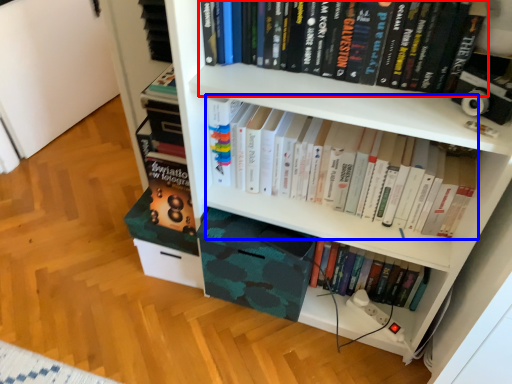
Question: Among these objects, which one is nearest to the camera, book (highlighted by a red box) or book (highlighted by a blue box)?

Choices:
 (A) book
 (B) book

Answer: (A)